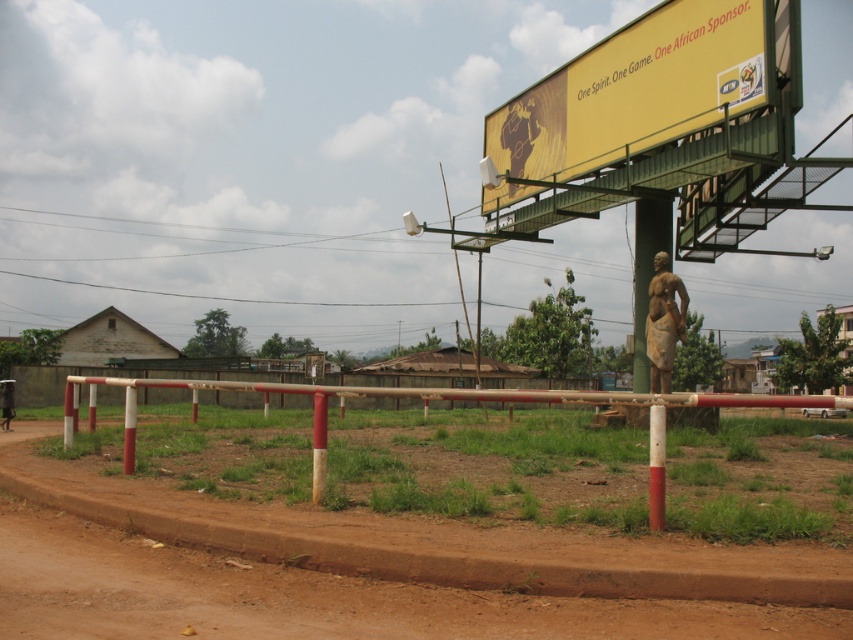
You are standing at the point marked as point (384,452) in the image. What object is located exactly at this point?

The white painted wood barrier at center is located exactly at point (384,452).

You are a delivery person trying to reach a package that was left on the brown dirt field at center. The white painted wood barrier at center is blocking your path. Can you go around the barrier to reach the dirt field?

The brown dirt field at center is behind the white painted wood barrier at center, so you can go around the barrier to reach the dirt field since it is blocking the path but not covering the entire area.